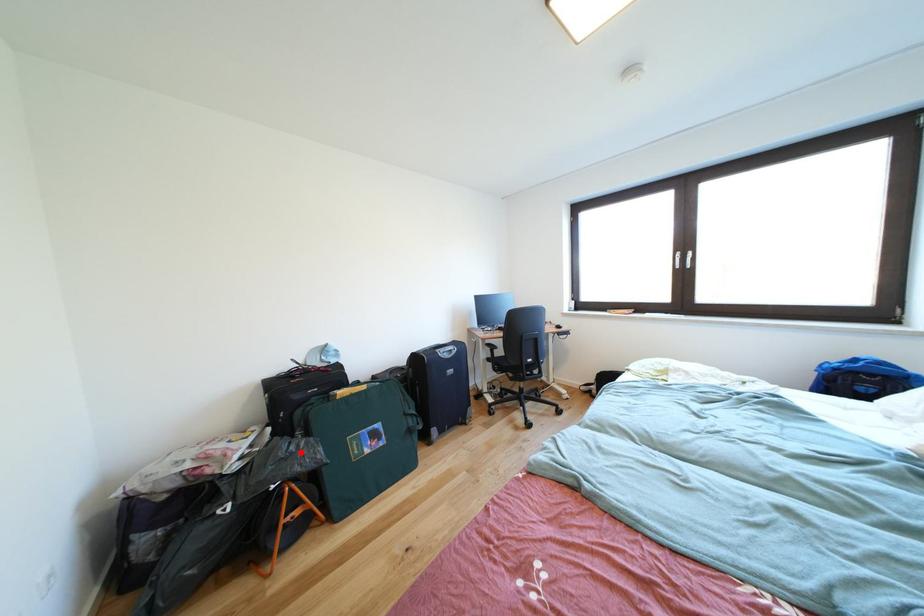
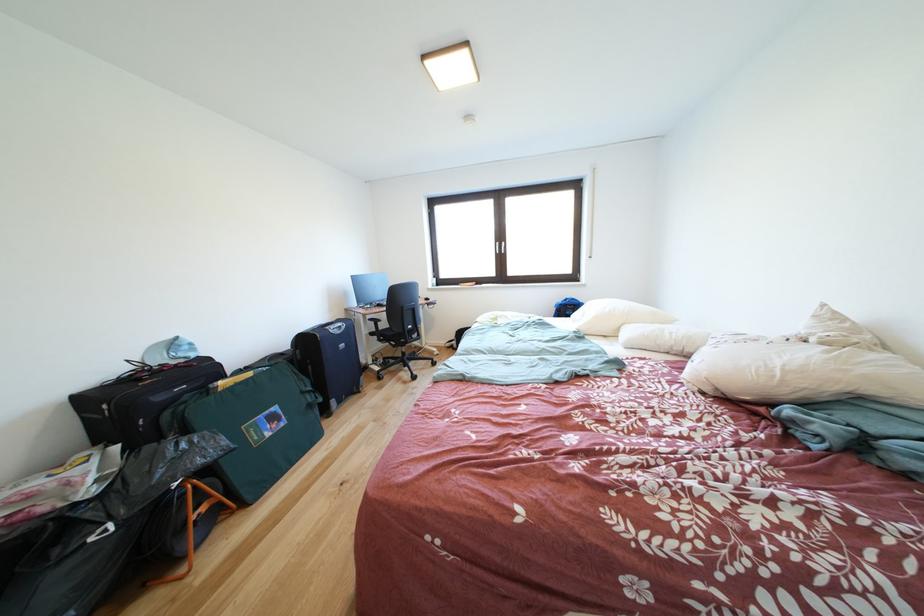
Locate, in the second image, the point that corresponds to the highlighted location in the first image.

(191, 450)